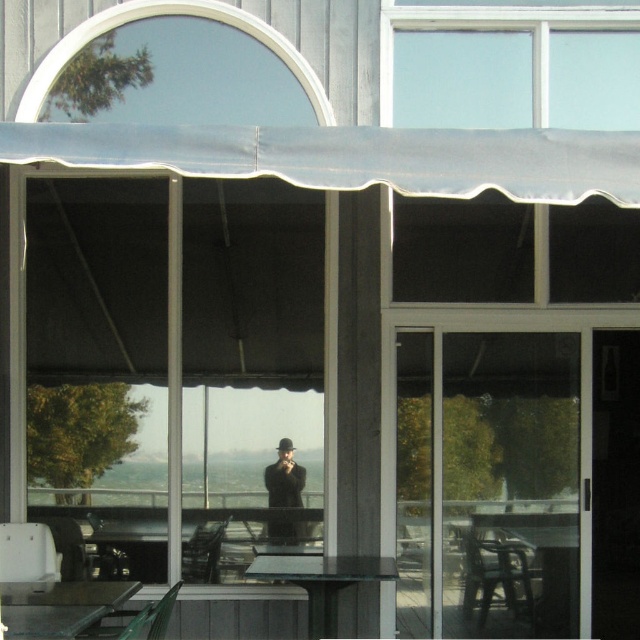
Between point (451, 436) and point (289, 488), which one is positioned in front?

Point (289, 488) is in front.

Does transparent glass door at center lie behind black matte coat at center?

That is False.

Describe the element at coordinates (486, 483) in the screenshot. Image resolution: width=640 pixels, height=640 pixels. I see `transparent glass door at center` at that location.

The height and width of the screenshot is (640, 640). I want to click on transparent glass door at center, so click(486, 483).

Is white fabric awning at upper center smaller than black matte coat at center?

Actually, white fabric awning at upper center might be larger than black matte coat at center.

Does white fabric awning at upper center have a larger size compared to black matte coat at center?

Yes.

You are a GUI agent. You are given a task and a screenshot of the screen. Output one action in this format:
    pyautogui.click(x=<x>, y=<y>)
    Task: Click on the white fabric awning at upper center
    
    Given the screenshot: What is the action you would take?
    pyautogui.click(x=355, y=157)

Looking at this image, does metallic silver table at lower left appear on the left side of transparent glass table at center?

Indeed, metallic silver table at lower left is positioned on the left side of transparent glass table at center.

Can you confirm if metallic silver table at lower left is wider than transparent glass table at center?

No, metallic silver table at lower left is not wider than transparent glass table at center.

Between point (3, 596) and point (387, 557), which one is positioned in front?

Point (3, 596) is in front.

Find the location of `metallic silver table at lower left`. metallic silver table at lower left is located at coordinates (60, 605).